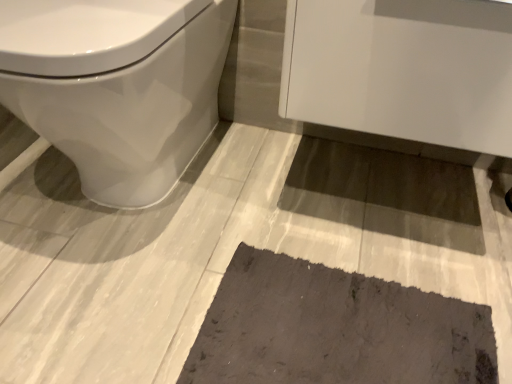
This screenshot has height=384, width=512. What do you see at coordinates (335, 329) in the screenshot? I see `dark gray textured bath mat at lower center` at bounding box center [335, 329].

Locate an element on the screen. white glossy cabinet at upper right is located at coordinates (402, 69).

Measure the distance from dark gray textured bath mat at lower center to white glossy toilet at left.

A distance of 18.17 inches exists between dark gray textured bath mat at lower center and white glossy toilet at left.

Is the position of dark gray textured bath mat at lower center more distant than that of white glossy toilet at left?

Yes, dark gray textured bath mat at lower center is behind white glossy toilet at left.

From a real-world perspective, does dark gray textured bath mat at lower center stand above white glossy toilet at left?

Incorrect, from a real-world perspective, dark gray textured bath mat at lower center is lower than white glossy toilet at left.

Is white glossy cabinet at upper right thinner than white glossy toilet at left?

Correct, the width of white glossy cabinet at upper right is less than that of white glossy toilet at left.

Which point is more forward, (x=298, y=57) or (x=61, y=110)?

Positioned in front is point (x=61, y=110).

Is white glossy toilet at left at the back of white glossy cabinet at upper right?

white glossy cabinet at upper right does not have its back to white glossy toilet at left.

What's the angular difference between dark gray textured bath mat at lower center and white glossy cabinet at upper right's facing directions?

The facing directions of dark gray textured bath mat at lower center and white glossy cabinet at upper right are 1.05 degrees apart.

Is dark gray textured bath mat at lower center in contact with white glossy cabinet at upper right?

No, dark gray textured bath mat at lower center is not next to white glossy cabinet at upper right.

Which object is positioned more to the left, dark gray textured bath mat at lower center or white glossy cabinet at upper right?

dark gray textured bath mat at lower center.

Is dark gray textured bath mat at lower center facing away from white glossy cabinet at upper right?

No.

Consider the image. How many degrees apart are the facing directions of white glossy toilet at left and white glossy cabinet at upper right?

They differ by 0.674 degrees in their facing directions.

Considering the positions of point (57, 65) and point (500, 146), is point (57, 65) closer or farther from the camera than point (500, 146)?

Point (57, 65) is positioned closer to the camera compared to point (500, 146).

Is white glossy cabinet at upper right surrounded by white glossy toilet at left?

No, white glossy toilet at left does not contain white glossy cabinet at upper right.

Can you confirm if white glossy toilet at left is positioned to the right of white glossy cabinet at upper right?

No, white glossy toilet at left is not to the right of white glossy cabinet at upper right.

Which is behind, point (505, 109) or point (227, 343)?

Positioned behind is point (227, 343).

From a real-world perspective, is white glossy cabinet at upper right physically located above or below dark gray textured bath mat at lower center?

Clearly, from a real-world perspective, white glossy cabinet at upper right is above dark gray textured bath mat at lower center.

Is white glossy cabinet at upper right bigger or smaller than dark gray textured bath mat at lower center?

In the image, white glossy cabinet at upper right appears to be larger than dark gray textured bath mat at lower center.

Can you tell me how much white glossy cabinet at upper right and dark gray textured bath mat at lower center differ in facing direction?

The angle between the facing direction of white glossy cabinet at upper right and the facing direction of dark gray textured bath mat at lower center is 1.05 degrees.

Does point (40, 40) come closer to viewer compared to point (409, 287)?

Yes.

From the image's perspective, is white glossy toilet at left above dark gray textured bath mat at lower center?

Correct, white glossy toilet at left appears higher than dark gray textured bath mat at lower center in the image.

Would you say white glossy toilet at left is inside or outside dark gray textured bath mat at lower center?

white glossy toilet at left is not inside dark gray textured bath mat at lower center, it's outside.

Can you confirm if white glossy toilet at left is taller than dark gray textured bath mat at lower center?

Yes, white glossy toilet at left is taller than dark gray textured bath mat at lower center.

Locate an element on the screen. This screenshot has width=512, height=384. bath mat located on the right of white glossy toilet at left is located at coordinates (335, 329).

The image size is (512, 384). In the image, there is a white glossy cabinet at upper right. Identify the location of toilet below it (from the image's perspective). (117, 86).

Looking at the image, which one is located further to white glossy toilet at left, dark gray textured bath mat at lower center or white glossy cabinet at upper right?

Among the two, dark gray textured bath mat at lower center is located further to white glossy toilet at left.

Estimate the real-world distances between objects in this image. Which object is further from white glossy cabinet at upper right, dark gray textured bath mat at lower center or white glossy toilet at left?

Based on the image, dark gray textured bath mat at lower center appears to be further to white glossy cabinet at upper right.

From the image, which object appears to be farther from white glossy toilet at left, white glossy cabinet at upper right or dark gray textured bath mat at lower center?

dark gray textured bath mat at lower center.

From the picture: Looking at the image, which one is located further to dark gray textured bath mat at lower center, white glossy toilet at left or white glossy cabinet at upper right?

white glossy toilet at left is positioned further to the anchor dark gray textured bath mat at lower center.

Based on their spatial positions, is white glossy cabinet at upper right or white glossy toilet at left closer to dark gray textured bath mat at lower center?

white glossy cabinet at upper right lies closer to dark gray textured bath mat at lower center than the other object.

Based on their spatial positions, is white glossy toilet at left or dark gray textured bath mat at lower center closer to white glossy cabinet at upper right?

white glossy toilet at left.

Locate an element on the screen. This screenshot has width=512, height=384. bath mat between white glossy toilet at left and white glossy cabinet at upper right is located at coordinates (335, 329).